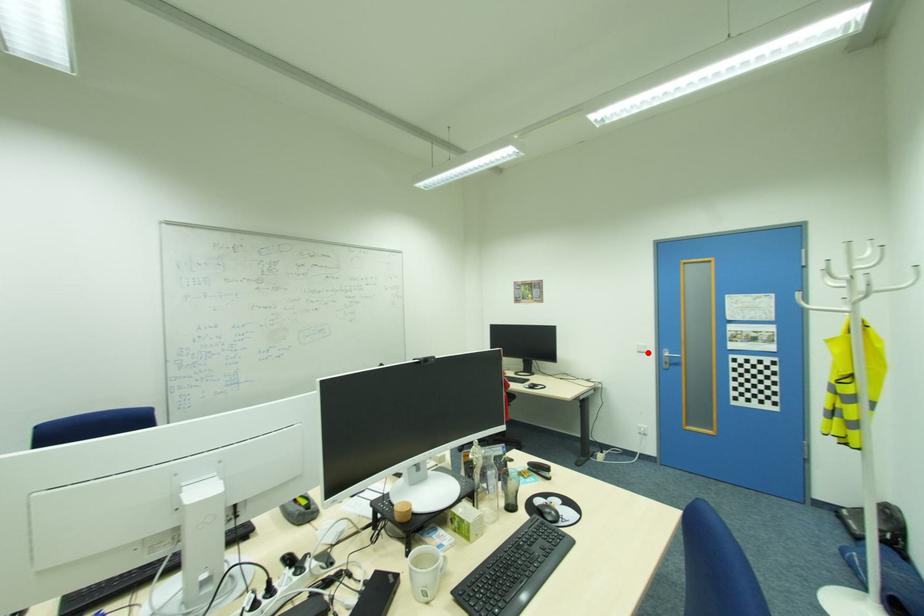
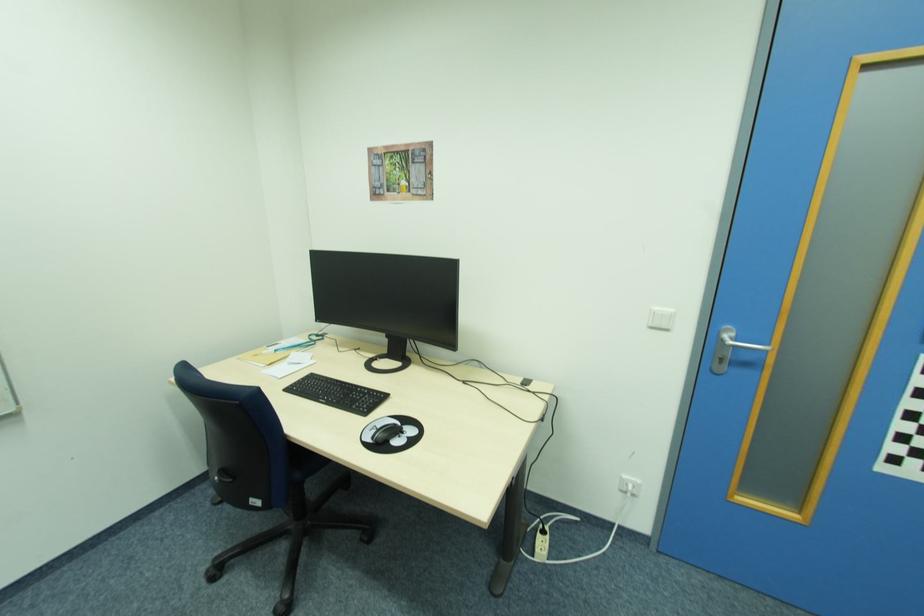
Where in the second image is the point corresponding to the highlighted location from the first image?

(670, 329)